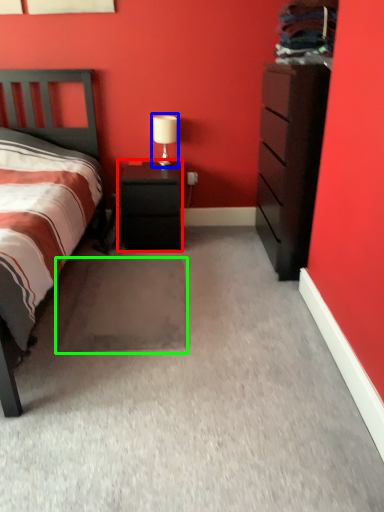
Question: Based on their relative distances, which object is farther from nightstand (highlighted by a red box)? Choose from table lamp (highlighted by a blue box) and footrest (highlighted by a green box).

Choices:
 (A) table lamp
 (B) footrest

Answer: (B)